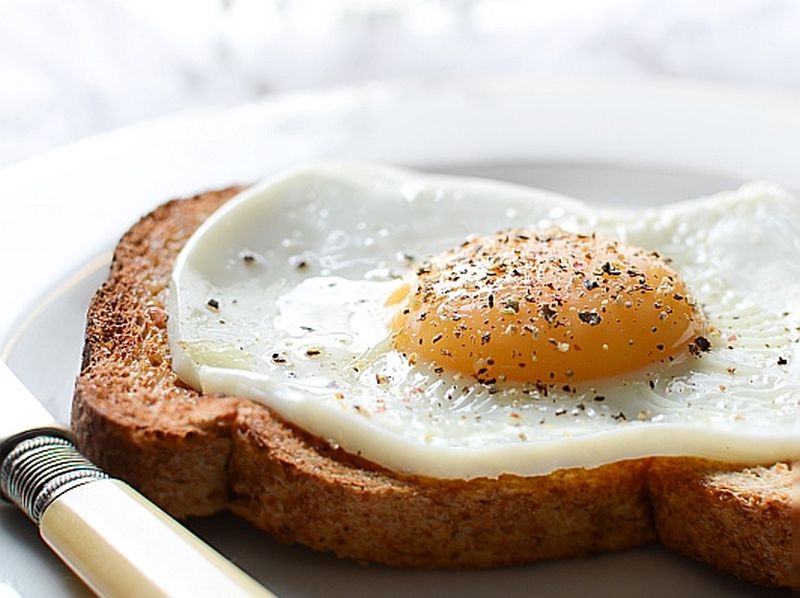
The height and width of the screenshot is (598, 800). Identify the location of surface. (358, 48).